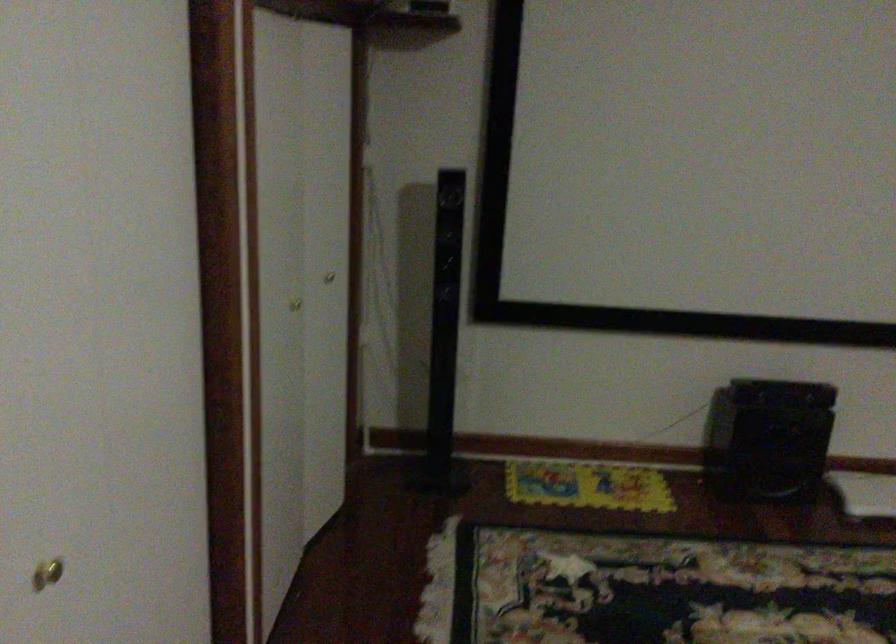
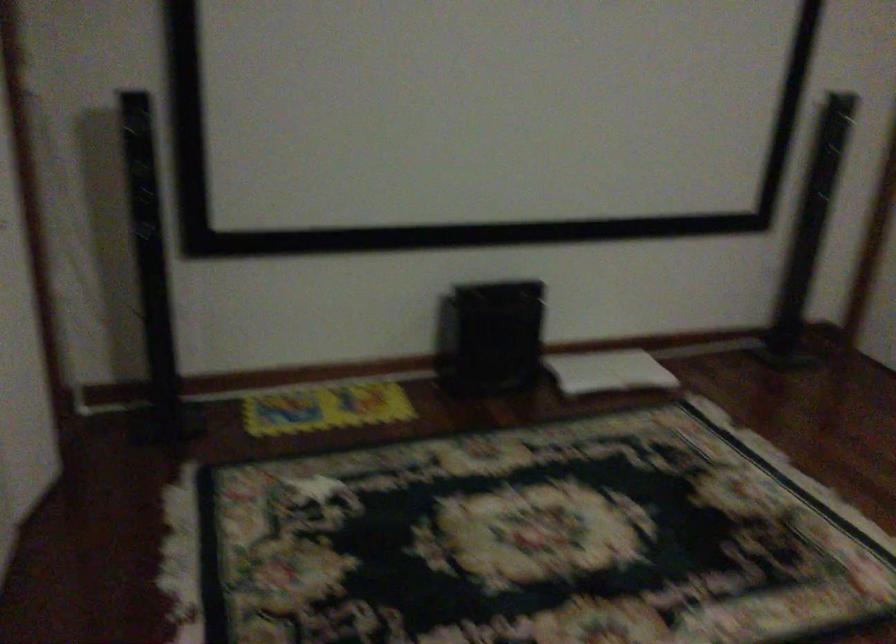
Question: The camera is either moving clockwise (left) or counter-clockwise (right) around the object. The first image is from the beginning of the video and the second image is from the end. Is the camera moving left or right when shooting the video?

Choices:
 (A) Left
 (B) Right

Answer: (A)